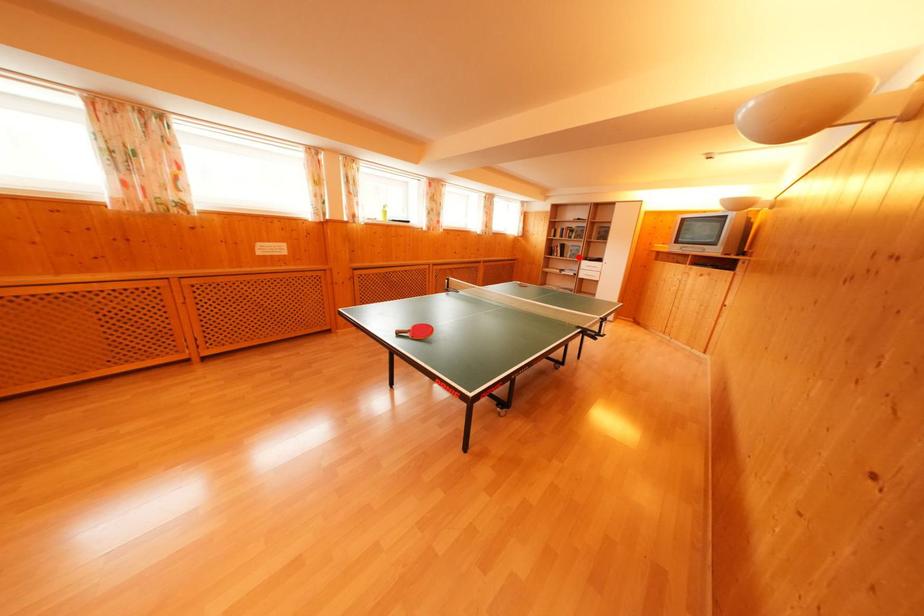
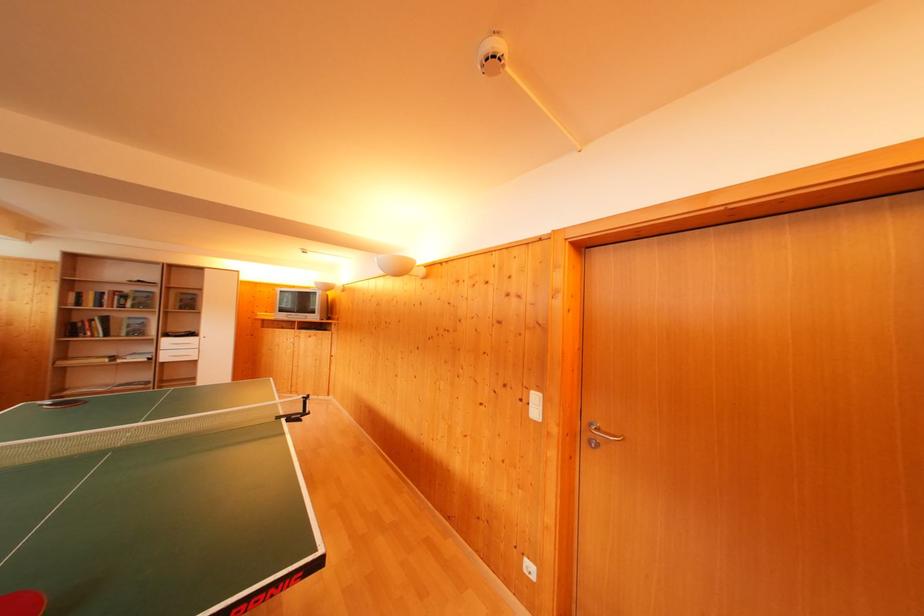
Question: I am providing you with two images of the same scene from different viewpoints. In image1, a red point is highlighted. Considering the same 3D point in image2, which of the following is correct?

Choices:
 (A) It is closer
 (B) It is farther

Answer: (B)